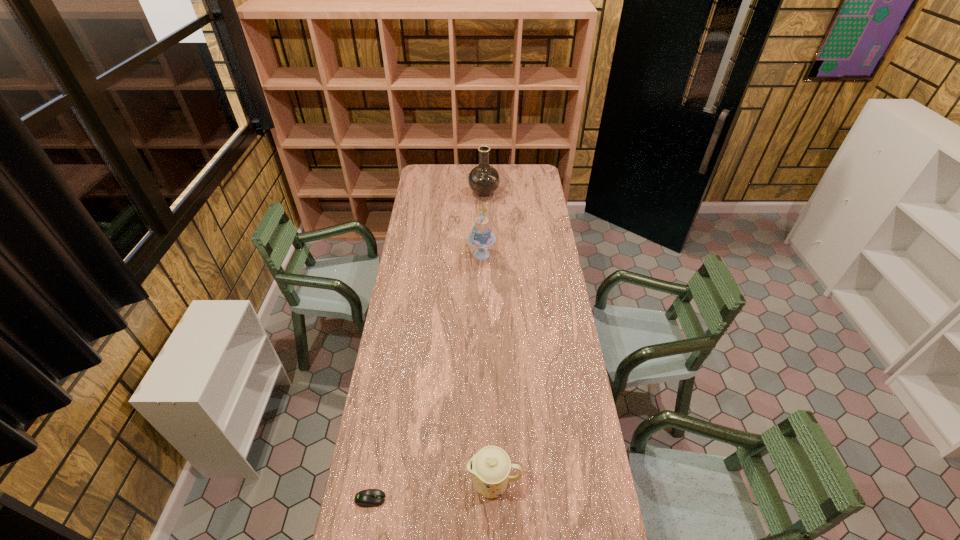
Identify the location of vase. (484, 179).

At what (x,y) coordinates should I click in order to perform the action: click on the third nearest object. Please return your answer as a coordinate pair (x, y). Looking at the image, I should click on (481, 236).

Find the location of `chinaware`. chinaware is located at coordinates (490, 467).

In order to click on computer mouse in this screenshot , I will do `click(367, 498)`.

Locate an element on the screen. The image size is (960, 540). the leftmost object is located at coordinates (367, 498).

The image size is (960, 540). What are the coordinates of `free location located on the front of the vase` in the screenshot? It's located at (484, 211).

Identify the location of free space located with a ladder on the side of the cake. This screenshot has width=960, height=540. (427, 254).

At what (x,y) coordinates should I click in order to perform the action: click on free region located 0.160m with a ladder on the side of the cake. Please return your answer as a coordinate pair (x, y). Image resolution: width=960 pixels, height=540 pixels. Looking at the image, I should click on (437, 254).

This screenshot has width=960, height=540. I want to click on vacant area situated with a ladder on the side of the cake, so click(437, 254).

Image resolution: width=960 pixels, height=540 pixels. I want to click on vacant space positioned on the spout of the second shortest object, so click(367, 483).